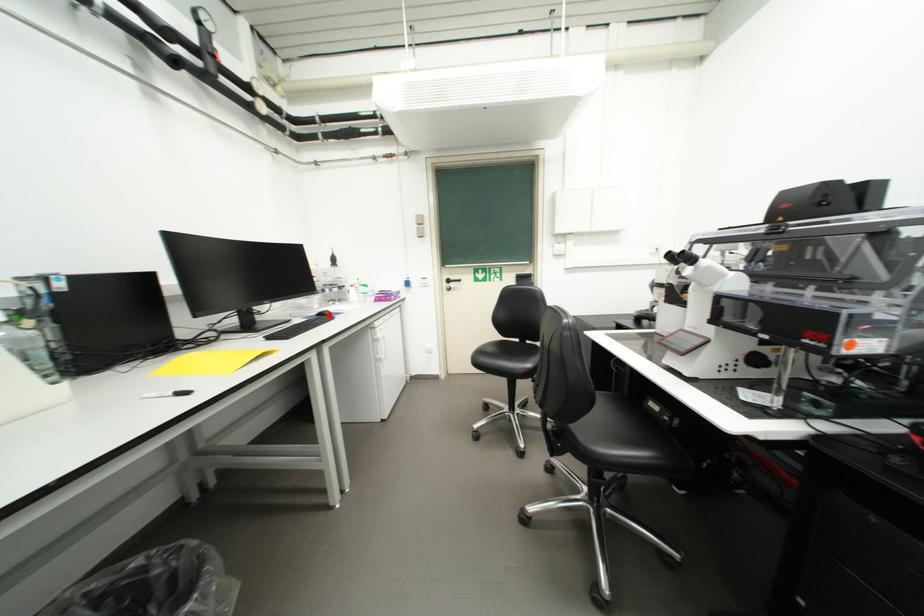
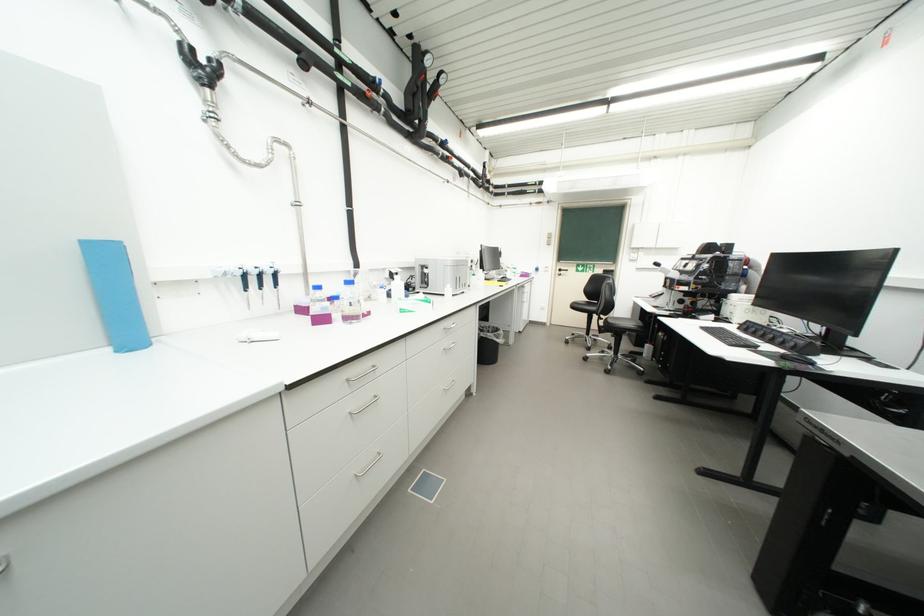
Question: I am providing you with two images of the same scene from different viewpoints. A red point is marked on the first image. Is the red point's position out of view in image 2?

Choices:
 (A) Yes
 (B) No

Answer: (A)